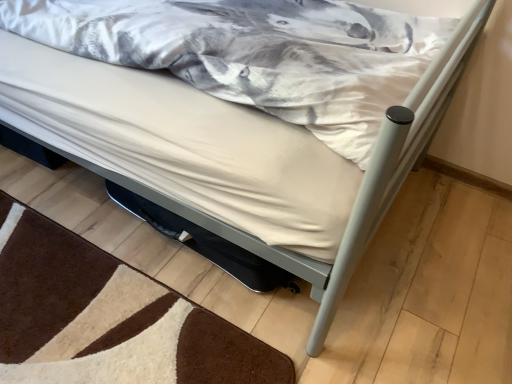
I want to click on free space above brown shaggy rug at lower left (from a real-world perspective), so click(x=89, y=310).